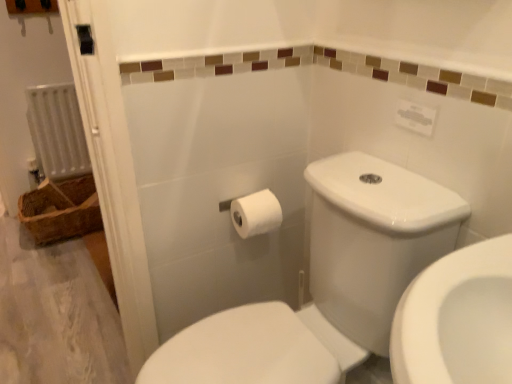
Question: From a real-world perspective, is white plastic radiator at left on top of white matte toilet paper at center?

Choices:
 (A) yes
 (B) no

Answer: (B)

Question: Would you say white matte toilet paper at center is part of white plastic radiator at left's contents?

Choices:
 (A) no
 (B) yes

Answer: (A)

Question: Can you confirm if white plastic radiator at left is wider than white matte toilet paper at center?

Choices:
 (A) no
 (B) yes

Answer: (A)

Question: From the image's perspective, is white plastic radiator at left above white matte toilet paper at center?

Choices:
 (A) yes
 (B) no

Answer: (A)

Question: Is white plastic radiator at left thinner than white matte toilet paper at center?

Choices:
 (A) yes
 (B) no

Answer: (A)

Question: Are white plastic radiator at left and white matte toilet paper at center far apart?

Choices:
 (A) no
 (B) yes

Answer: (B)

Question: Considering the relative sizes of white glossy toilet at center and white plastic radiator at left in the image provided, is white glossy toilet at center wider than white plastic radiator at left?

Choices:
 (A) no
 (B) yes

Answer: (B)

Question: From a real-world perspective, is white glossy toilet at center positioned under white plastic radiator at left based on gravity?

Choices:
 (A) no
 (B) yes

Answer: (B)

Question: Is white glossy toilet at center shorter than white plastic radiator at left?

Choices:
 (A) no
 (B) yes

Answer: (A)

Question: Considering the relative sizes of white glossy toilet at center and white plastic radiator at left in the image provided, is white glossy toilet at center bigger than white plastic radiator at left?

Choices:
 (A) yes
 (B) no

Answer: (A)

Question: Considering the relative sizes of white glossy toilet at center and white plastic radiator at left in the image provided, is white glossy toilet at center taller than white plastic radiator at left?

Choices:
 (A) yes
 (B) no

Answer: (A)

Question: Is there a large distance between white glossy toilet at center and white plastic radiator at left?

Choices:
 (A) no
 (B) yes

Answer: (B)

Question: From the image's perspective, is woven brown basket at left below white glossy toilet at center?

Choices:
 (A) no
 (B) yes

Answer: (A)